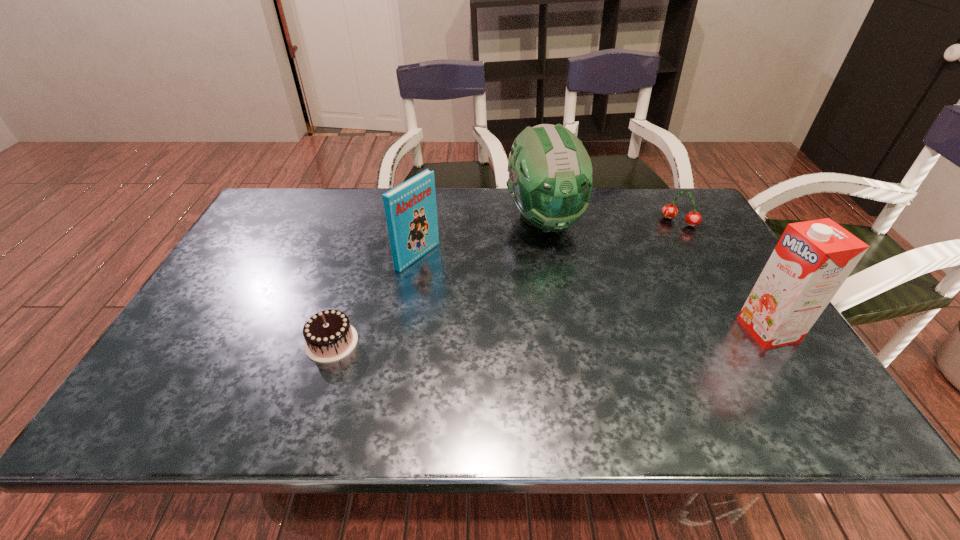
The width and height of the screenshot is (960, 540). Identify the location of the shortest object. click(x=329, y=337).

Find the location of `chocolate cake`. chocolate cake is located at coordinates click(x=329, y=337).

You are a GUI agent. You are given a task and a screenshot of the screen. Output one action in this format:
    pyautogui.click(x=<x>, y=<y>)
    Task: Click on the carton
    
    Given the screenshot: What is the action you would take?
    pyautogui.click(x=811, y=261)

You are a GUI agent. You are given a task and a screenshot of the screen. Output one action in this format:
    pyautogui.click(x=<x>, y=<y>)
    Task: Click on the cherry
    
    Given the screenshot: What is the action you would take?
    pyautogui.click(x=669, y=211)

Where is `book`? The width and height of the screenshot is (960, 540). book is located at coordinates (410, 208).

Where is `the fourth object from right to left`? This screenshot has width=960, height=540. the fourth object from right to left is located at coordinates (410, 208).

In order to click on the third object from right to left in this screenshot , I will do `click(550, 181)`.

The width and height of the screenshot is (960, 540). In order to click on vacant space located on the left of the chocolate cake in this screenshot , I will do `click(272, 342)`.

Locate an element on the screen. blank area located on the back of the carton is located at coordinates (737, 282).

Where is `free region located with stems pointing upwards on the cherry`? The height and width of the screenshot is (540, 960). free region located with stems pointing upwards on the cherry is located at coordinates (646, 264).